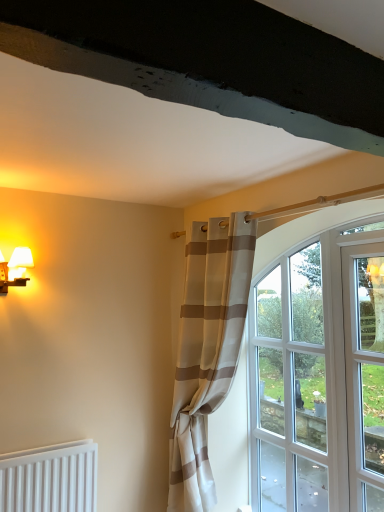
What do you see at coordinates (319, 376) in the screenshot? Image resolution: width=384 pixels, height=512 pixels. I see `clear glass window at center` at bounding box center [319, 376].

What do you see at coordinates (364, 372) in the screenshot?
I see `clear glass door at right` at bounding box center [364, 372].

Where is `clear glass door at right`? clear glass door at right is located at coordinates 364,372.

What do you see at coordinates (14, 269) in the screenshot? I see `matte white table lamp at left` at bounding box center [14, 269].

Locate an element on the screen. The height and width of the screenshot is (512, 384). clear glass window at center is located at coordinates (319, 376).

From a real-world perspective, relative to beige striped curtain at center, is clear glass door at right vertically above or below?

From a real-world perspective, clear glass door at right is physically above beige striped curtain at center.

Looking at this image, which object is closer to the camera, clear glass door at right or beige striped curtain at center?

clear glass door at right is in front.

Looking at the image, does clear glass door at right seem bigger or smaller compared to beige striped curtain at center?

In the image, clear glass door at right appears to be smaller than beige striped curtain at center.

Which of these two, clear glass door at right or beige striped curtain at center, stands taller?

beige striped curtain at center is taller.

Does matte white table lamp at left turn towards clear glass window at center?

No, matte white table lamp at left is not aimed at clear glass window at center.

Is matte white table lamp at left next to clear glass window at center?

No, matte white table lamp at left is not in contact with clear glass window at center.

Between matte white table lamp at left and clear glass window at center, which one has larger width?

With larger width is matte white table lamp at left.

Is clear glass door at right facing towards matte white table lamp at left?

No, clear glass door at right is not turned towards matte white table lamp at left.

Can you see clear glass door at right touching matte white table lamp at left?

No, clear glass door at right is not in contact with matte white table lamp at left.

Is clear glass door at right wider or thinner than matte white table lamp at left?

In the image, clear glass door at right appears to be more narrow than matte white table lamp at left.

Based on the photo, from a real-world perspective, is clear glass door at right over matte white table lamp at left?

No, from a real-world perspective, clear glass door at right is not above matte white table lamp at left.

From a real-world perspective, is clear glass window at center located beneath matte white table lamp at left?

Yes.

Image resolution: width=384 pixels, height=512 pixels. What are the coordinates of `table lamp located on the left of clear glass window at center` in the screenshot? It's located at (14, 269).

Between clear glass window at center and matte white table lamp at left, which one appears on the left side from the viewer's perspective?

Positioned to the left is matte white table lamp at left.

Is clear glass window at center turned away from matte white table lamp at left?

No, clear glass window at center is not facing away from matte white table lamp at left.

Which of these two, beige striped curtain at center or clear glass window at center, is bigger?

Bigger between the two is beige striped curtain at center.

Is beige striped curtain at center with clear glass window at center?

No, beige striped curtain at center is not with clear glass window at center.

Can clear glass window at center be found inside beige striped curtain at center?

Definitely not — clear glass window at center is not inside beige striped curtain at center.

Does matte white table lamp at left appear on the right side of clear glass door at right?

Incorrect, matte white table lamp at left is not on the right side of clear glass door at right.

From the image's perspective, is matte white table lamp at left over clear glass door at right?

Correct, matte white table lamp at left appears higher than clear glass door at right in the image.

Is matte white table lamp at left positioned before clear glass door at right?

No, matte white table lamp at left is behind clear glass door at right.

Who is shorter, matte white table lamp at left or clear glass door at right?

Standing shorter between the two is matte white table lamp at left.

What's the angular difference between clear glass window at center and clear glass door at right's facing directions?

0.00797 degrees.

Identify the location of window behind the clear glass door at right. The width and height of the screenshot is (384, 512). (319, 376).

From the image's perspective, does clear glass window at center appear lower than clear glass door at right?

Result: Correct, clear glass window at center appears lower than clear glass door at right in the image.

Considering the relative sizes of clear glass window at center and clear glass door at right in the image provided, is clear glass window at center bigger than clear glass door at right?

Yes.

Locate an element on the screen. Image resolution: width=384 pixels, height=512 pixels. screen door that appears above the beige striped curtain at center (from a real-world perspective) is located at coordinates (364, 372).

This screenshot has height=512, width=384. I want to click on window on the right of matte white table lamp at left, so click(x=319, y=376).

Considering their positions, is beige striped curtain at center positioned further to clear glass door at right than clear glass window at center?

Based on the image, beige striped curtain at center appears to be further to clear glass door at right.

When comparing their distances from clear glass door at right, does matte white table lamp at left or beige striped curtain at center seem further?

matte white table lamp at left is positioned further to the anchor clear glass door at right.

Estimate the real-world distances between objects in this image. Which object is further from matte white table lamp at left, clear glass door at right or clear glass window at center?

Based on the image, clear glass door at right appears to be further to matte white table lamp at left.

Looking at this image, based on their spatial positions, is clear glass window at center or clear glass door at right further from matte white table lamp at left?

clear glass door at right is positioned further to the anchor matte white table lamp at left.

Based on their spatial positions, is clear glass door at right or matte white table lamp at left closer to beige striped curtain at center?

clear glass door at right lies closer to beige striped curtain at center than the other object.

From the image, which object appears to be nearer to clear glass window at center, beige striped curtain at center or matte white table lamp at left?

beige striped curtain at center is closer to clear glass window at center.

Looking at the image, which one is located closer to clear glass door at right, clear glass window at center or beige striped curtain at center?

Among the two, clear glass window at center is located nearer to clear glass door at right.

Which object lies nearer to the anchor point beige striped curtain at center, clear glass window at center or clear glass door at right?

clear glass window at center is positioned closer to the anchor beige striped curtain at center.

This screenshot has width=384, height=512. I want to click on window between matte white table lamp at left and clear glass door at right from left to right, so tap(319, 376).

The image size is (384, 512). I want to click on curtain located between matte white table lamp at left and clear glass door at right in the left-right direction, so click(207, 350).

You are a GUI agent. You are given a task and a screenshot of the screen. Output one action in this format:
    pyautogui.click(x=<x>, y=<y>)
    Task: Click on the window situated between beige striped curtain at center and clear glass door at right from left to right
    
    Given the screenshot: What is the action you would take?
    pyautogui.click(x=319, y=376)

Find the location of `curtain between matte white table lamp at left and clear glass window at center in the horizontal direction`. curtain between matte white table lamp at left and clear glass window at center in the horizontal direction is located at coordinates (207, 350).